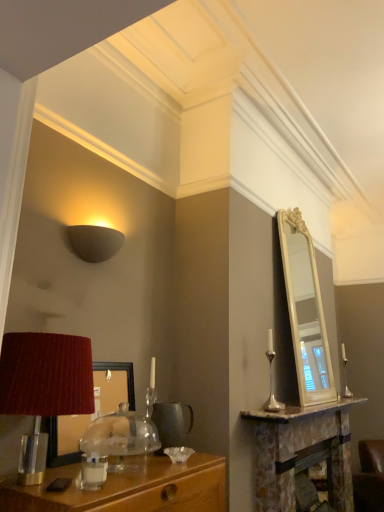
Question: Can we say brown leather swivel chair at lower right lies outside matte black mirror at left?

Choices:
 (A) no
 (B) yes

Answer: (B)

Question: Is brown leather swivel chair at lower right turned away from matte black mirror at left?

Choices:
 (A) yes
 (B) no

Answer: (B)

Question: Is brown leather swivel chair at lower right thinner than matte black mirror at left?

Choices:
 (A) no
 (B) yes

Answer: (A)

Question: Can you confirm if brown leather swivel chair at lower right is taller than matte black mirror at left?

Choices:
 (A) no
 (B) yes

Answer: (B)

Question: Does brown leather swivel chair at lower right lie behind matte black mirror at left?

Choices:
 (A) no
 (B) yes

Answer: (B)

Question: From a real-world perspective, is brown leather swivel chair at lower right positioned under matte black mirror at left based on gravity?

Choices:
 (A) no
 (B) yes

Answer: (B)

Question: Is matte gray wall sconce at upper left positioned in front of matte red lampshade at left?

Choices:
 (A) no
 (B) yes

Answer: (A)

Question: Is matte gray wall sconce at upper left not near matte red lampshade at left?

Choices:
 (A) no
 (B) yes

Answer: (A)

Question: From a real-world perspective, does matte gray wall sconce at upper left stand above matte red lampshade at left?

Choices:
 (A) no
 (B) yes

Answer: (B)

Question: Is matte gray wall sconce at upper left smaller than matte red lampshade at left?

Choices:
 (A) yes
 (B) no

Answer: (A)

Question: From the image's perspective, does matte gray wall sconce at upper left appear higher than matte red lampshade at left?

Choices:
 (A) yes
 (B) no

Answer: (A)

Question: Is matte gray wall sconce at upper left looking in the opposite direction of matte red lampshade at left?

Choices:
 (A) no
 (B) yes

Answer: (A)

Question: Can you confirm if matte black mirror at left is thinner than matte gray wall sconce at upper left?

Choices:
 (A) yes
 (B) no

Answer: (A)